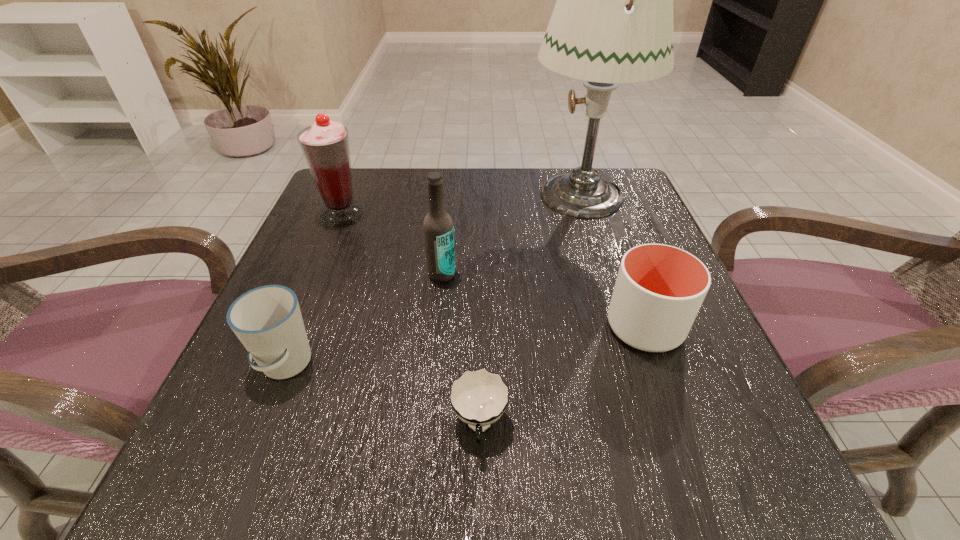
This screenshot has width=960, height=540. I want to click on vacant space situated 0.160m on the lampshade of the lampshade, so click(459, 194).

This screenshot has width=960, height=540. What are the coordinates of `vacant region located 0.390m on the front of the smoothie` in the screenshot? It's located at (273, 383).

This screenshot has height=540, width=960. I want to click on vacant space located 0.320m on the side of the beer bottle with the label, so click(x=424, y=451).

Where is `vacant position located 0.070m on the left of the rightmost cup`? The height and width of the screenshot is (540, 960). vacant position located 0.070m on the left of the rightmost cup is located at coordinates (564, 327).

Identify the location of vacant space situated with a handle on the side of the leftmost cup. The width and height of the screenshot is (960, 540). (252, 449).

I want to click on lampshade at the far edge, so click(612, 23).

You are a GUI agent. You are given a task and a screenshot of the screen. Output one action in this format:
    pyautogui.click(x=<x>, y=<y>)
    Task: Click on the smoothie that is at the far edge
    The width and height of the screenshot is (960, 540).
    Given the screenshot: What is the action you would take?
    pyautogui.click(x=325, y=145)

The width and height of the screenshot is (960, 540). I want to click on object that is positioned at the near edge, so click(x=479, y=397).

Identify the location of smoothie situated at the left edge. Image resolution: width=960 pixels, height=540 pixels. (325, 145).

This screenshot has height=540, width=960. In order to click on cup located in the left edge section of the desktop in this screenshot , I will do `click(267, 320)`.